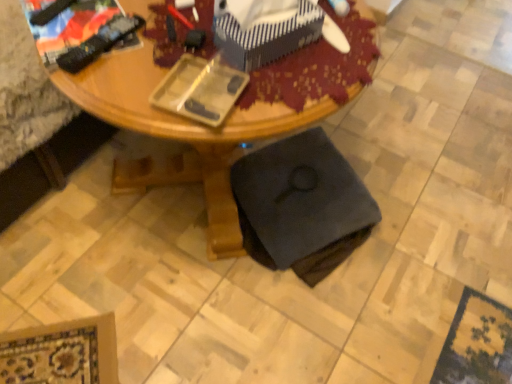
At what (x,y) coordinates should I click in order to perform the action: click on free location in front of black fabric swivel chair at lower center. Please return your answer as a coordinate pair (x, y). This screenshot has width=512, height=384. Looking at the image, I should click on (298, 320).